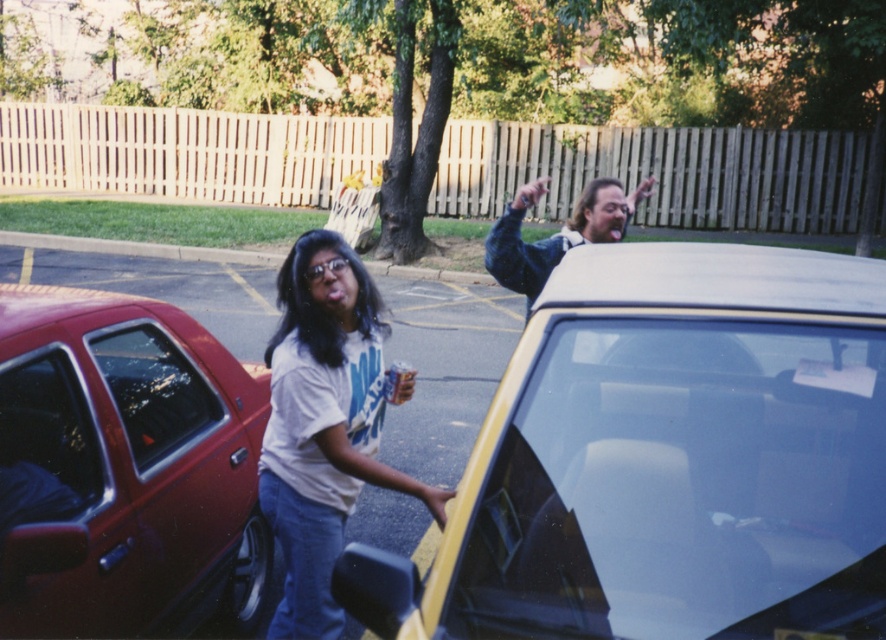
You are a delivery person who needs to place a small package on the object that is larger between the denim jacket at upper right and the smooth yellow car door handle at lower center. Which object should you choose?

The denim jacket at upper right is larger in size than the smooth yellow car door handle at lower center, so you should place the package on the denim jacket at upper right.

You are a delivery person who needs to place a package on the ground between the denim jacket at upper right and the smooth yellow car door handle at lower center. Can you fit the package there?

The denim jacket at upper right is taller than the smooth yellow car door handle at lower center, so there is vertical space between them. The package can be placed on the ground between them as long as it fits horizontally within the available space.